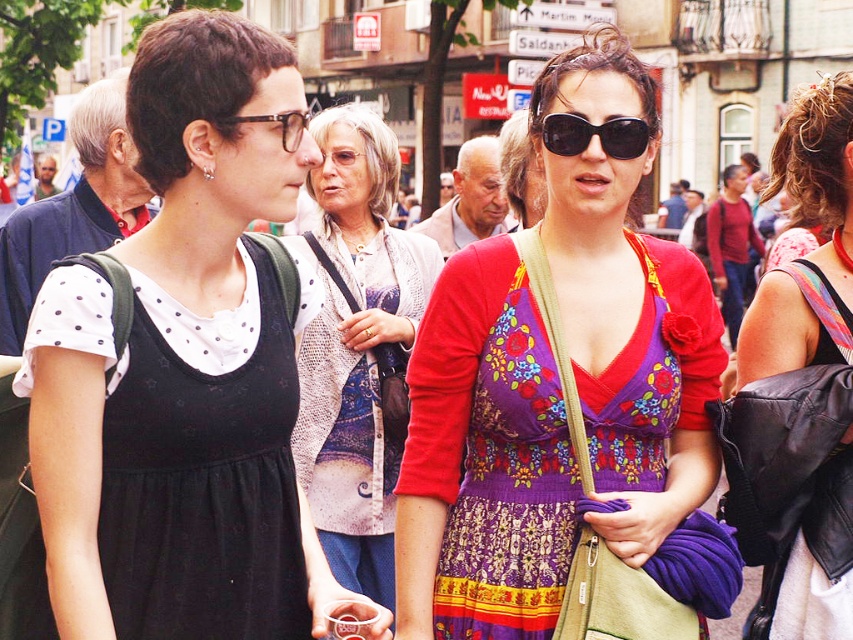
Can you confirm if black plastic sunglasses at center is thinner than matte black glasses at upper center?

No, black plastic sunglasses at center is not thinner than matte black glasses at upper center.

Between point (641, 148) and point (291, 145), which one is positioned behind?

The point (641, 148) is behind.

Between point (564, 134) and point (224, 120), which one is positioned in front?

Point (224, 120)

Locate an element on the screen. This screenshot has width=853, height=640. black plastic sunglasses at center is located at coordinates (595, 134).

Does vibrant floral dress at center have a greater width compared to matte black glasses at upper center?

Yes, vibrant floral dress at center is wider than matte black glasses at upper center.

Who is positioned more to the left, vibrant floral dress at center or matte black glasses at upper center?

Positioned to the left is matte black glasses at upper center.

Is point (474, 339) positioned before point (306, 113)?

No, (474, 339) is further to viewer.

Where is `vibrant floral dress at center`? This screenshot has height=640, width=853. vibrant floral dress at center is located at coordinates (555, 385).

Does black jersey dress at left have a lesser height compared to black plastic sunglasses at center?

Incorrect, black jersey dress at left's height does not fall short of black plastic sunglasses at center's.

Which is more to the left, black jersey dress at left or black plastic sunglasses at center?

black jersey dress at left is more to the left.

Identify the location of black jersey dress at left. (204, 486).

This screenshot has height=640, width=853. What are the coordinates of `black jersey dress at left` in the screenshot? It's located at (204, 486).